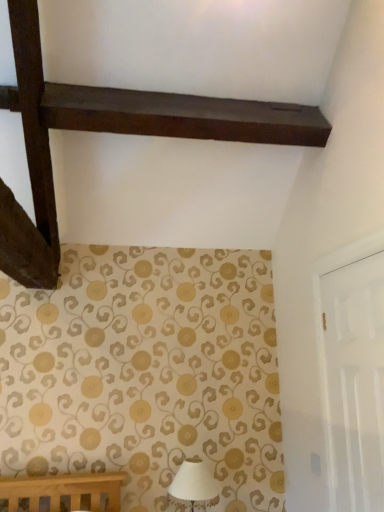
Where is `white matte table lamp at lower center`? white matte table lamp at lower center is located at coordinates (194, 482).

The height and width of the screenshot is (512, 384). Describe the element at coordinates (194, 482) in the screenshot. I see `white matte table lamp at lower center` at that location.

The image size is (384, 512). I want to click on white matte table lamp at lower center, so click(x=194, y=482).